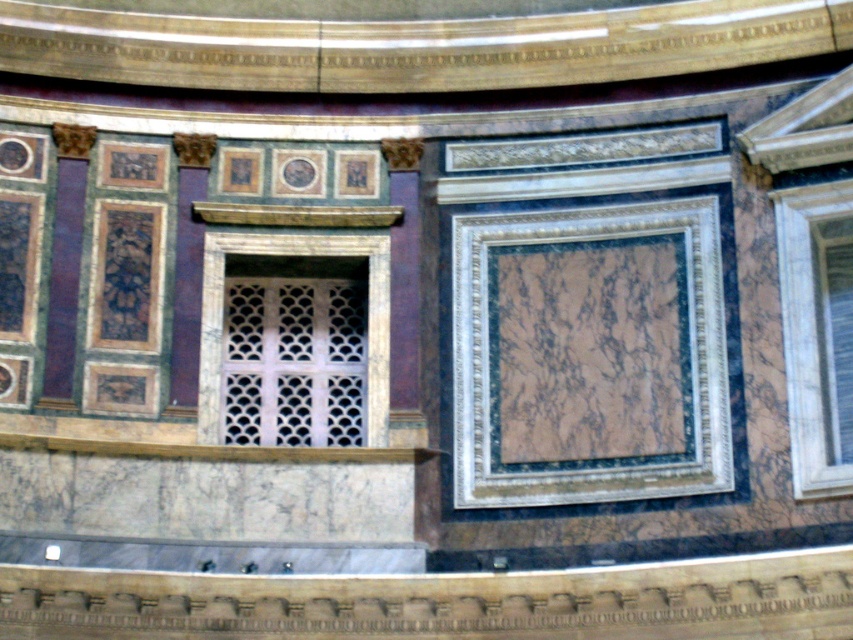
You are an interior designer planning to install a new lighting fixture between the marble at center and the white marble window at center. The fixture requires a minimum of 5 meters of space between them to be safely installed. Can the fixture be placed there?

The marble at center and the white marble window at center are 5.38 meters apart from each other, which exceeds the minimum requirement of 5 meters. Therefore, the lighting fixture can be safely installed between them.